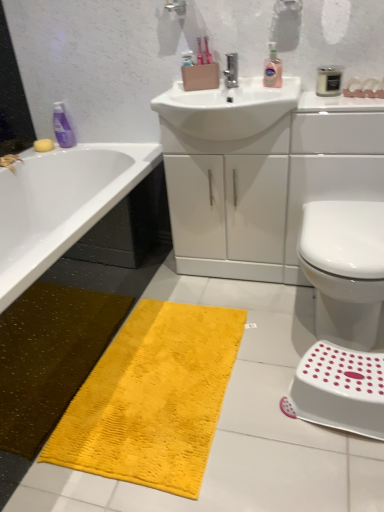
You are a GUI agent. You are given a task and a screenshot of the screen. Output one action in this format:
    pyautogui.click(x=<x>, y=<y>)
    Task: Click on the vacant space that is in between white plastic step stool at lower right and yellow plush bath mat at lower center
    This screenshot has height=512, width=384.
    Given the screenshot: What is the action you would take?
    pyautogui.click(x=269, y=407)